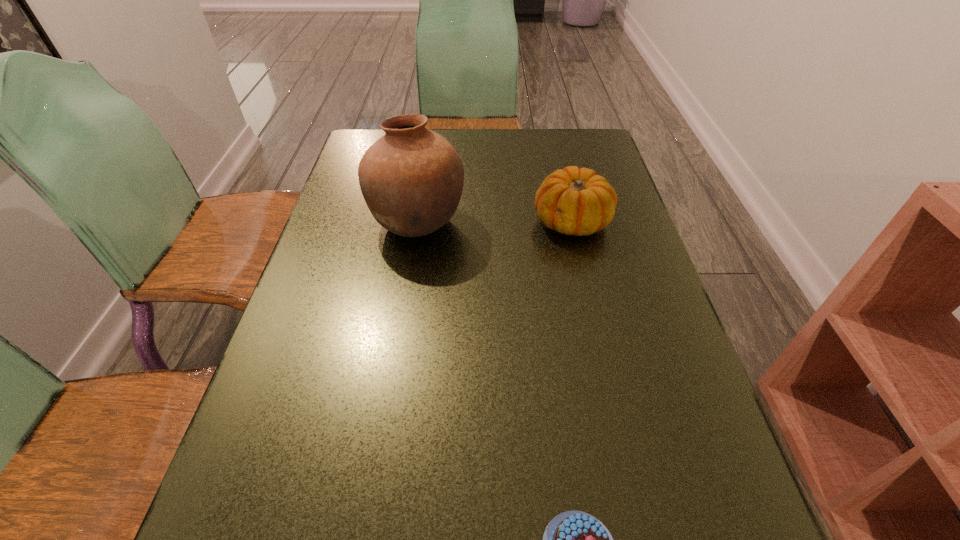
The height and width of the screenshot is (540, 960). Find the location of `pottery`. pottery is located at coordinates (411, 178).

I want to click on the leftmost object, so click(x=411, y=178).

Identify the location of gourd. (576, 201).

I want to click on vacant position located on the front of the leftmost object, so click(x=390, y=400).

The height and width of the screenshot is (540, 960). I want to click on vacant space situated on the back of the gourd, so click(x=550, y=129).

I want to click on object that is at the left edge, so click(411, 178).

This screenshot has height=540, width=960. Identify the location of object that is positioned at the right edge. (576, 201).

You are a GUI agent. You are given a task and a screenshot of the screen. Output one action in this format:
    pyautogui.click(x=<x>, y=<y>)
    Task: Click on the free space at the far edge of the desktop
    Image resolution: width=960 pixels, height=540 pixels.
    Given the screenshot: What is the action you would take?
    pyautogui.click(x=487, y=166)

This screenshot has width=960, height=540. In the image, there is a desktop. Identify the location of free space at the left edge. (311, 303).

Where is `free space at the right edge of the desktop`? This screenshot has width=960, height=540. free space at the right edge of the desktop is located at coordinates (659, 479).